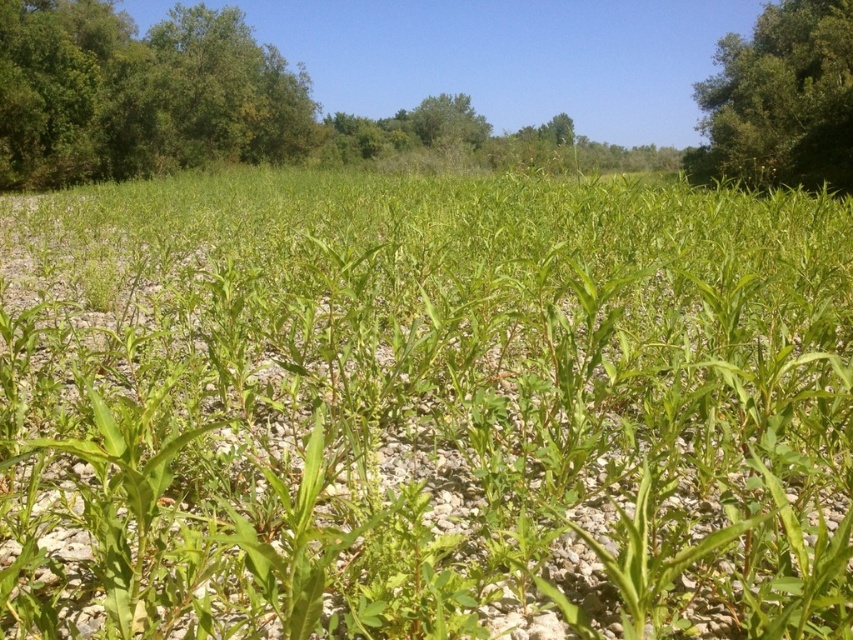
You are standing in the field of young green plants. You see the green leafy corn at center and the green leafy tree at upper right. Which one is closer to you?

The green leafy corn at center is closer to you since it is only 76.06 feet away from the green leafy tree at upper right, meaning the corn is nearer than the tree.

You are standing in the middle of the field of green plants and see the green leafy corn at center and the green leafy tree at upper right. Which object is closer to you?

The green leafy corn at center is closer to you because it has a smaller size compared to the green leafy tree at upper right, which is further away.

You are standing in the field of young green plants growing sparsely across a bed of small, light colored stones or gravel. You see a point marked at coordinates (x=138, y=93). What object is located at this point?

The point at coordinates (x=138, y=93) marks the location of the green leafy tree at upper left.